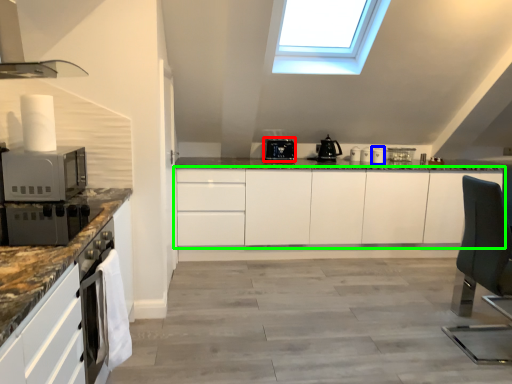
Question: Considering the real-world distances, which object is farthest from kitchen appliance (highlighted by a red box)? appliance (highlighted by a blue box) or cabinetry (highlighted by a green box)?

Choices:
 (A) appliance
 (B) cabinetry

Answer: (A)